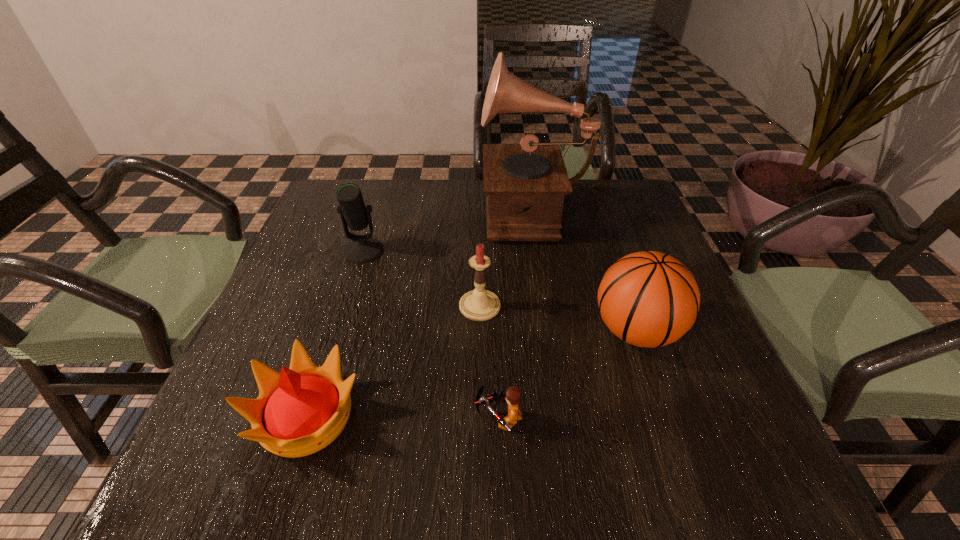
This screenshot has width=960, height=540. What are the coordinates of `crown that is at the left edge` in the screenshot? It's located at (301, 410).

Where is `object situated at the right edge`? object situated at the right edge is located at coordinates (649, 299).

Locate an element on the screen. This screenshot has width=960, height=540. object that is at the near left corner is located at coordinates (301, 410).

Locate an element on the screen. Image resolution: width=960 pixels, height=540 pixels. free space at the far edge of the desktop is located at coordinates (584, 203).

I want to click on free space at the near edge, so click(x=576, y=454).

At what (x,y) coordinates should I click in order to perform the action: click on vacant space at the left edge of the desktop. Please return your answer as a coordinate pair (x, y). Image resolution: width=960 pixels, height=540 pixels. Looking at the image, I should click on (333, 229).

Image resolution: width=960 pixels, height=540 pixels. I want to click on vacant point at the far left corner, so click(x=371, y=184).

This screenshot has width=960, height=540. I want to click on free location at the far right corner of the desktop, so click(x=614, y=216).

At what (x,y) coordinates should I click in order to perform the action: click on vacant space at the near right corner of the desktop. Please return your answer as a coordinate pair (x, y). Image resolution: width=960 pixels, height=540 pixels. Looking at the image, I should click on (751, 456).

Locate an element on the screen. free space between the candle and the crown is located at coordinates (393, 361).